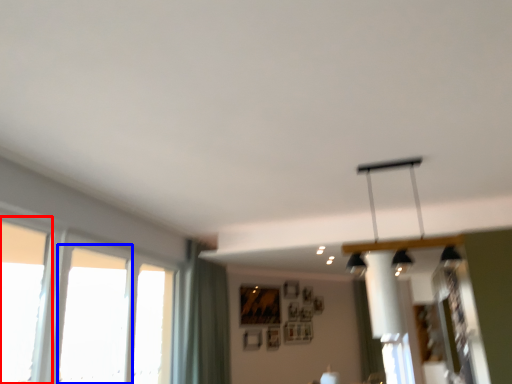
Question: Which point is further to the camera, window (highlighted by a red box) or window (highlighted by a blue box)?

Choices:
 (A) window
 (B) window

Answer: (B)